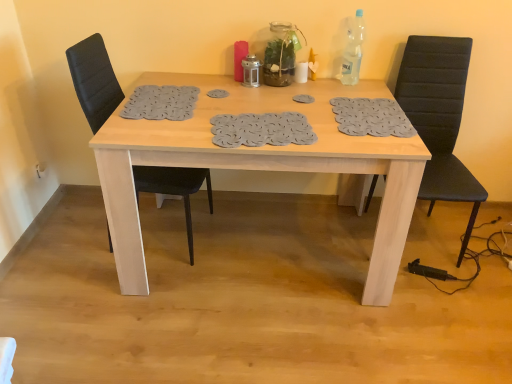
You are a GUI agent. You are given a task and a screenshot of the screen. Output one action in this format:
    pyautogui.click(x=<x>, y=<y>)
    Task: Click on the free space in front of light wood table at center
    This screenshot has height=384, width=512.
    Given the screenshot: What is the action you would take?
    pyautogui.click(x=252, y=340)